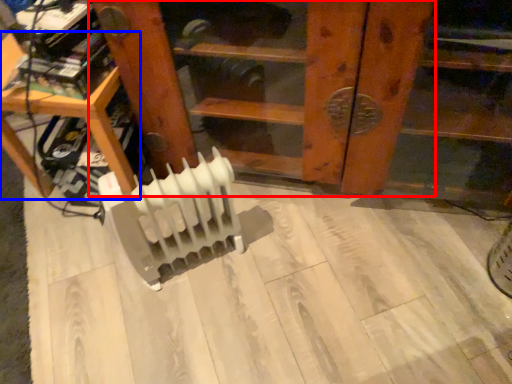
Question: Among these objects, which one is nearest to the camera, furniture (highlighted by a red box) or furniture (highlighted by a blue box)?

Choices:
 (A) furniture
 (B) furniture

Answer: (A)